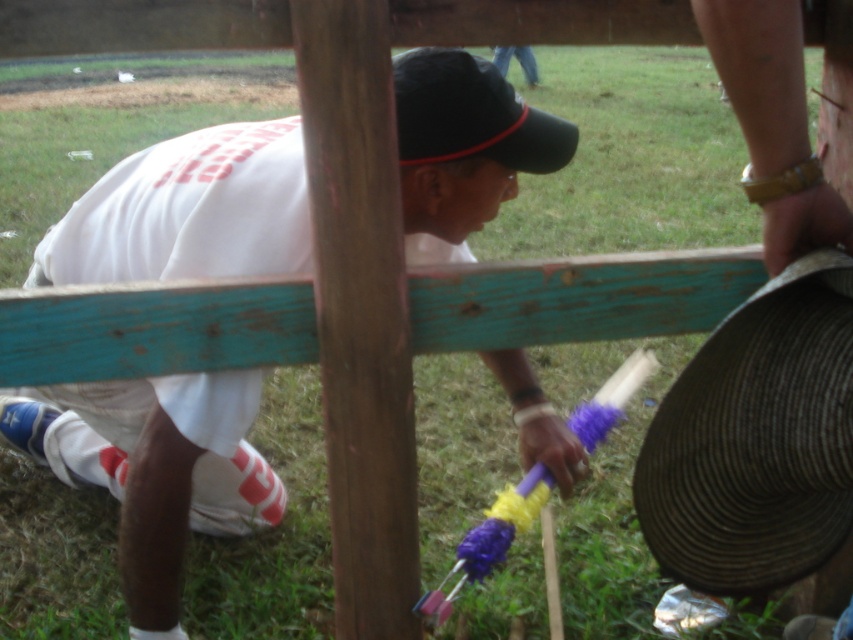
You are standing at the point marked as point (756, 440). What object is located at this point?

The brown woven hat at lower right is located at point (756, 440).

You are a photographer taking a picture of the two hats in the scene. The brown woven hat at lower right and the black fabric baseball hat at center are both in your view. Which hat is closer to the camera?

The brown woven hat at lower right is positioned under the black fabric baseball hat at center, so the black fabric baseball hat at center is closer to the camera.